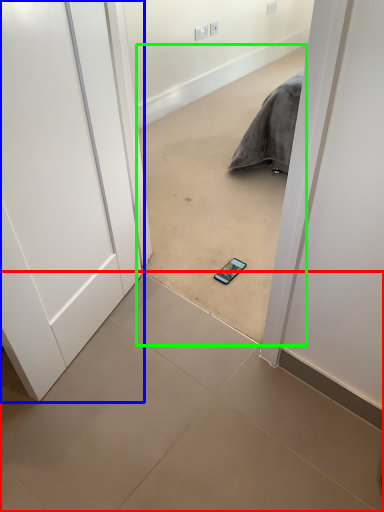
Question: Estimate the real-world distances between objects in this image. Which object is closer to ceramic tile (highlighted by a red box), door (highlighted by a blue box) or concrete (highlighted by a green box)?

Choices:
 (A) door
 (B) concrete

Answer: (A)